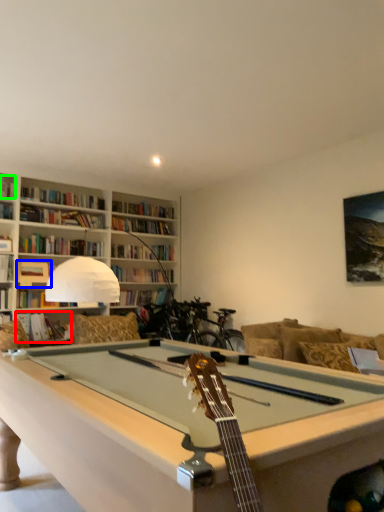
Question: Which object is positioned farthest from book (highlighted by a red box)? Select from book (highlighted by a blue box) and book (highlighted by a green box).

Choices:
 (A) book
 (B) book

Answer: (B)